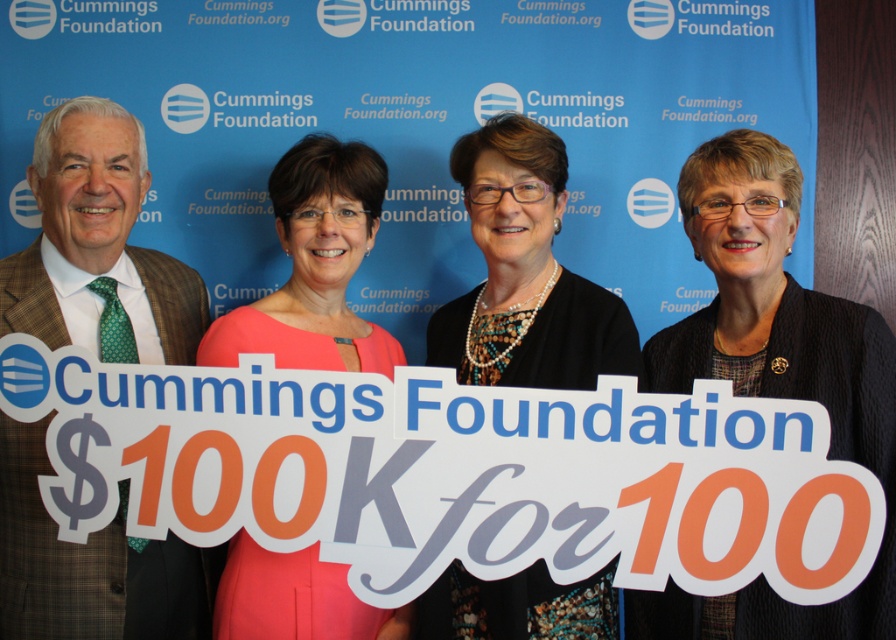
Question: Which object is farther from the camera taking this photo?

Choices:
 (A) pearl necklace at center
 (B) pink satin dress at center
 (C) black textured blazer at center

Answer: (A)

Question: Does green textured tie at left have a lesser width compared to pearl necklace at center?

Choices:
 (A) no
 (B) yes

Answer: (B)

Question: Which point is farther to the camera?

Choices:
 (A) pink satin dress at center
 (B) green textured tie at left

Answer: (A)

Question: Is green textured tie at left wider than pink satin dress at center?

Choices:
 (A) no
 (B) yes

Answer: (A)

Question: Does green textured tie at left have a larger size compared to pink satin dress at center?

Choices:
 (A) yes
 (B) no

Answer: (A)

Question: Which of the following is the farthest from the observer?

Choices:
 (A) (613, 360)
 (B) (793, 387)
 (C) (131, 353)
 (D) (351, 636)

Answer: (C)